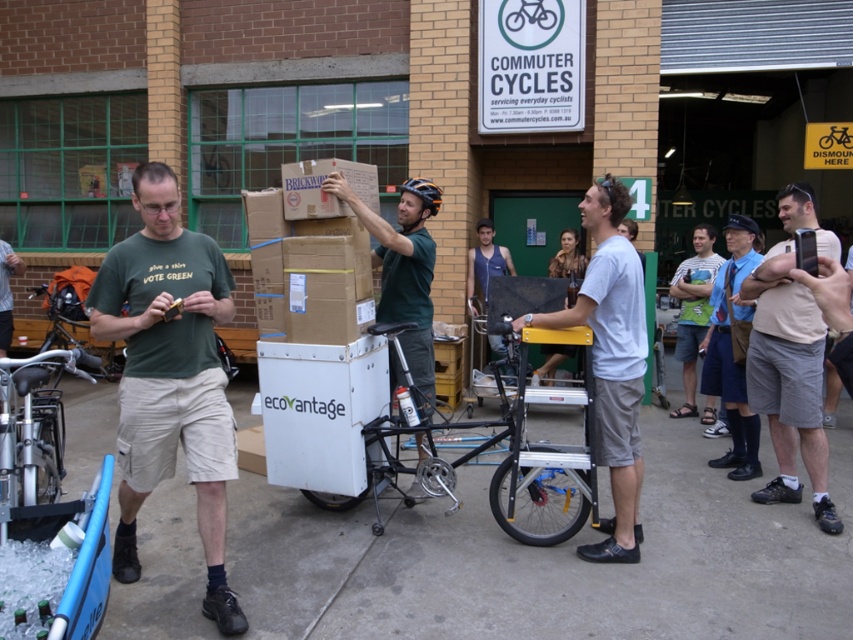
Question: Which of the following is the farthest from the observer?

Choices:
 (A) (509, 388)
 (B) (509, 13)

Answer: (B)

Question: Which object is closer to the camera taking this photo?

Choices:
 (A) green t-shirt at left
 (B) white matte bicycle at center
 (C) light beige shorts at right
 (D) green fabric bag at center

Answer: (A)

Question: Estimate the real-world distances between objects in this image. Which object is farther from the black matte cargo bike at center?

Choices:
 (A) blue fabric cap at upper right
 (B) green t-shirt at left

Answer: (A)

Question: From the image, what is the correct spatial relationship of light beige shorts at right in relation to silver metallic bicycle at center?

Choices:
 (A) above
 (B) below

Answer: (B)

Question: Does black matte cargo bike at center lie in front of silver metallic bicycle at center?

Choices:
 (A) no
 (B) yes

Answer: (B)

Question: Is black matte cargo bike at center smaller than matte green helmet at center?

Choices:
 (A) no
 (B) yes

Answer: (A)